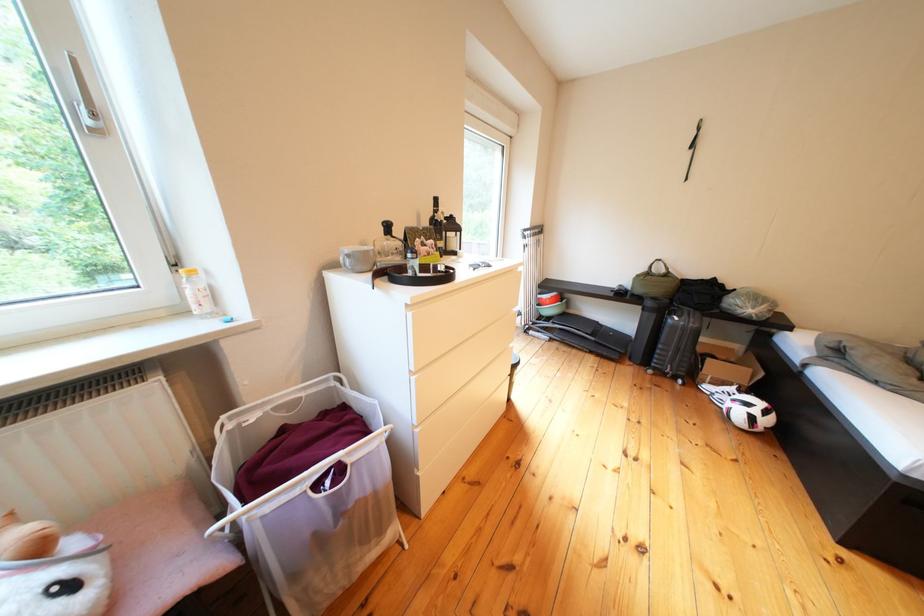
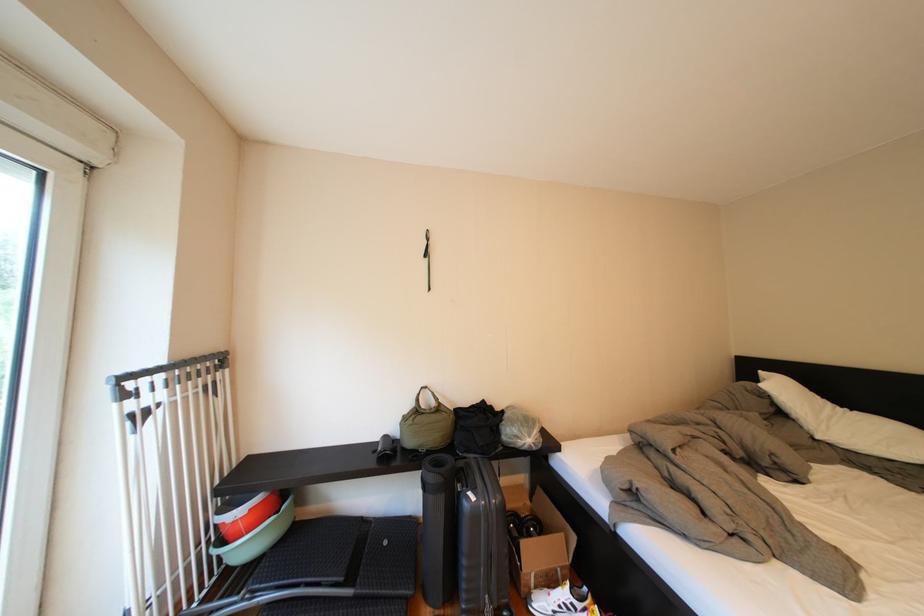
The point at [552,235] is marked in the first image. Where is the corresponding point in the second image?

(224, 369)